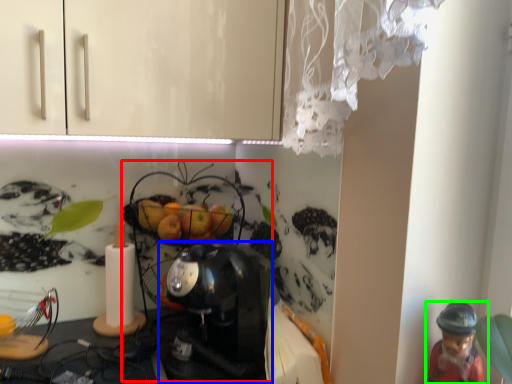
Question: Which object is positioned closest to toy (highlighted by a red box)? Select from coffee maker (highlighted by a blue box) and person (highlighted by a green box).

Choices:
 (A) coffee maker
 (B) person

Answer: (A)